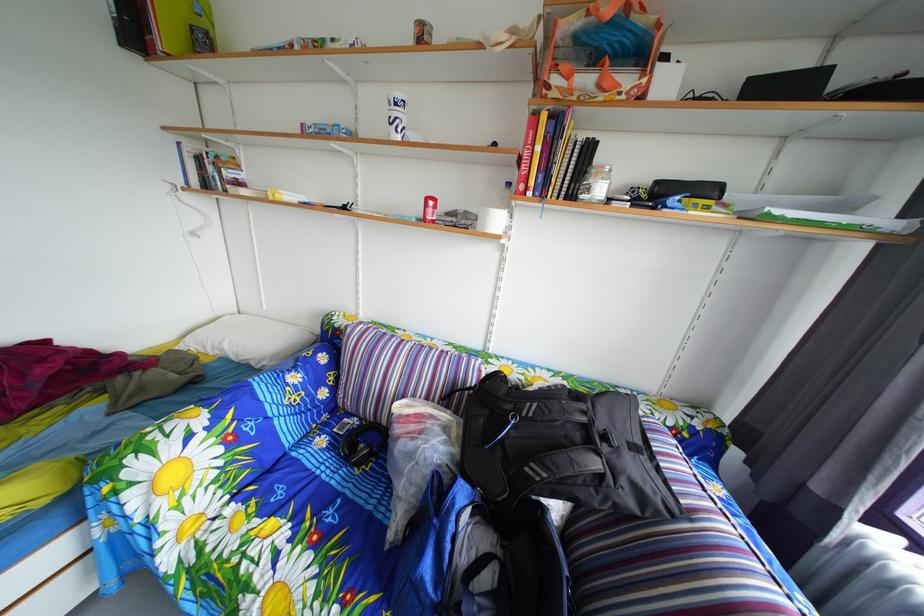
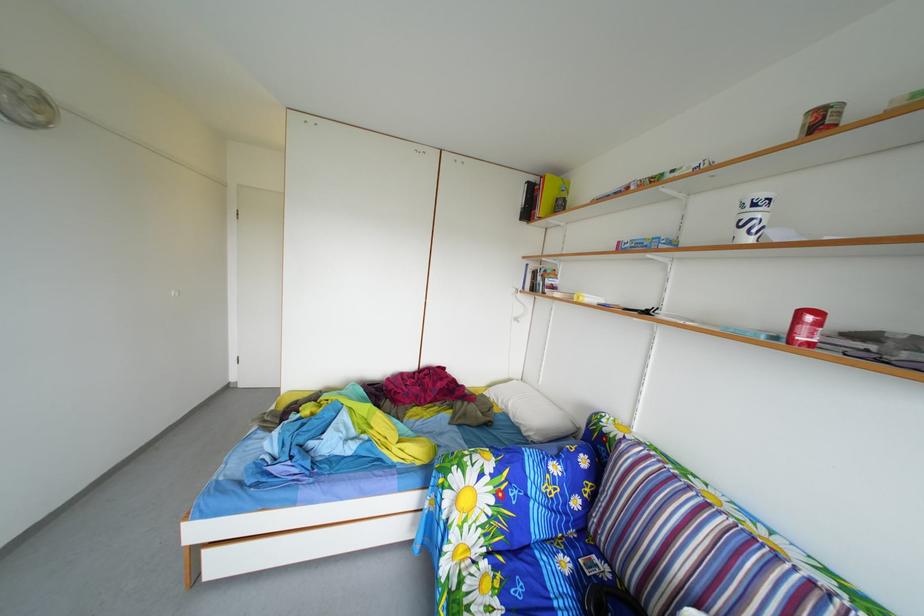
In the second image, find the point that corresponds to [438,207] in the first image.

(811, 321)